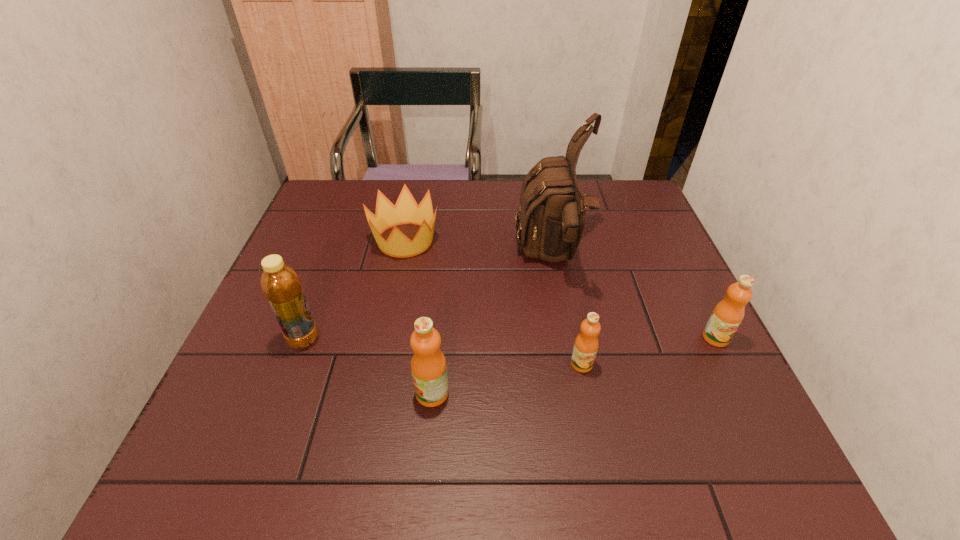
Find the location of a particular element. vacant area that lies between the shoulder bag and the second nearest orange juice is located at coordinates (566, 311).

Locate an element on the screen. vacant region between the rightmost orange juice and the second orange juice from right to left is located at coordinates (649, 351).

Where is `unoccupied position between the shoulder bag and the leftmost orange juice`? The image size is (960, 540). unoccupied position between the shoulder bag and the leftmost orange juice is located at coordinates (492, 326).

Find the location of a particular element. The image size is (960, 540). empty space between the shoulder bag and the second shortest orange juice is located at coordinates (634, 298).

Image resolution: width=960 pixels, height=540 pixels. Find the location of `vacant space that is in between the crown and the rightmost object`. vacant space that is in between the crown and the rightmost object is located at coordinates (561, 289).

Locate an element on the screen. This screenshot has height=540, width=960. free area in between the shortest object and the rightmost object is located at coordinates (561, 289).

In order to click on free spot between the tallest object and the rightmost orange juice in this screenshot , I will do `click(634, 298)`.

At what (x,y) coordinates should I click in order to perform the action: click on free spot between the tallest object and the leftmost orange juice. Please return your answer as a coordinate pair (x, y). This screenshot has height=540, width=960. Looking at the image, I should click on (492, 326).

Point out which object is positioned as the nearest to the leftmost orange juice. Please provide its 2D coordinates. Your answer should be formatted as a tuple, i.e. [(x, y)], where the tuple contains the x and y coordinates of a point satisfying the conditions above.

[(280, 283)]

Find the location of `the closest object to the shoulder bag`. the closest object to the shoulder bag is located at coordinates (586, 344).